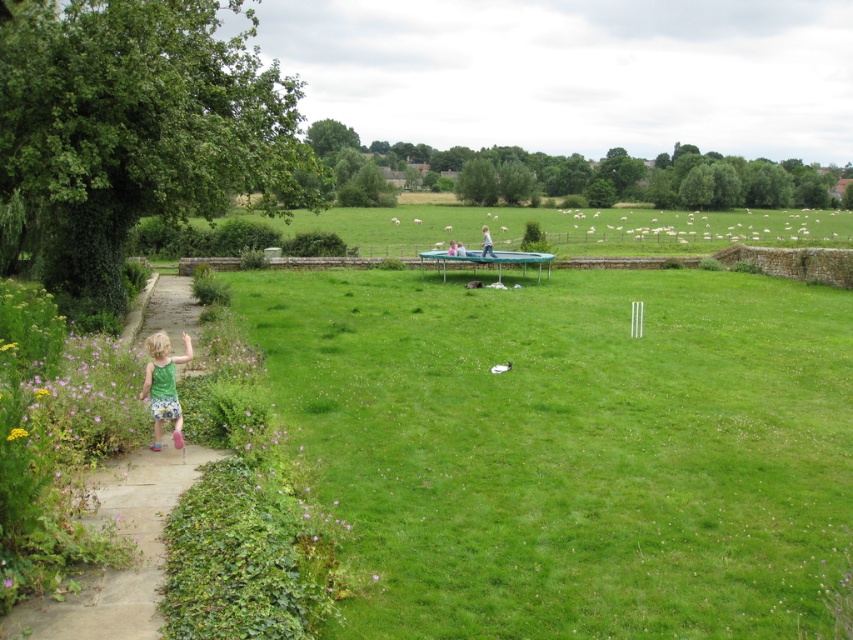
Between brown stone path at left and yellow/yellowish-green textured flower at lower left, which one is positioned higher?

Positioned higher is brown stone path at left.

Could you measure the distance between brown stone path at left and yellow/yellowish-green textured flower at lower left?

brown stone path at left is 4.46 meters from yellow/yellowish-green textured flower at lower left.

Between point (123, 465) and point (13, 436), which one is positioned in front?

Point (13, 436) is more forward.

Locate an element on the screen. brown stone path at left is located at coordinates (132, 561).

Is green grassy field at center to the left of yellow/yellowish-green textured flower at lower left from the viewer's perspective?

Incorrect, green grassy field at center is not on the left side of yellow/yellowish-green textured flower at lower left.

Does green grassy field at center have a smaller size compared to yellow/yellowish-green textured flower at lower left?

No.

The width and height of the screenshot is (853, 640). Find the location of `green grassy field at center`. green grassy field at center is located at coordinates (569, 448).

Which is above, green cotton dress at left or yellow/yellowish-green textured flower at lower left?

green cotton dress at left

Who is taller, green cotton dress at left or yellow/yellowish-green textured flower at lower left?

green cotton dress at left is taller.

Find the location of `green cotton dress at left`. green cotton dress at left is located at coordinates (163, 385).

Locate an element on the screen. The height and width of the screenshot is (640, 853). green cotton dress at left is located at coordinates (163, 385).